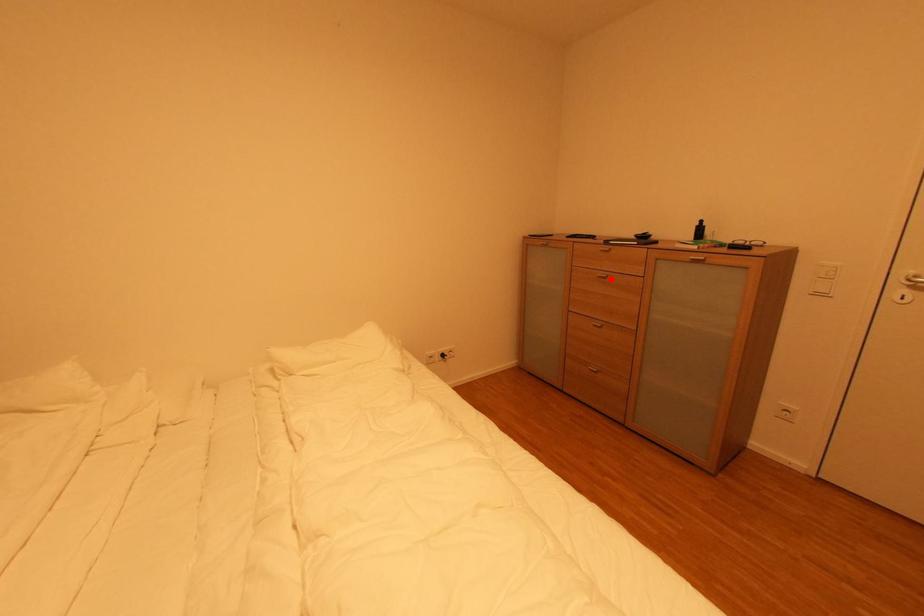
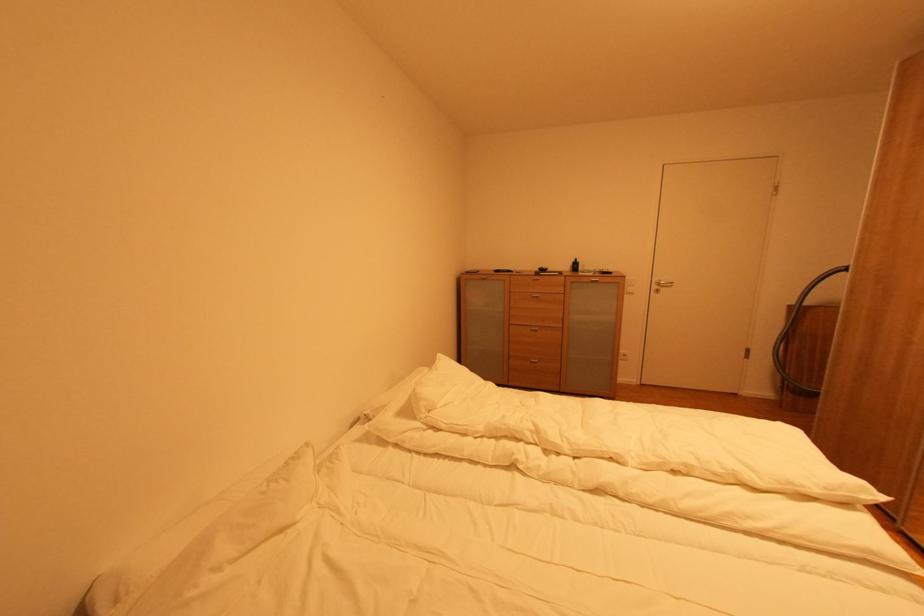
Find the pixel in the second image that matches the highlighted location in the first image.

(542, 298)